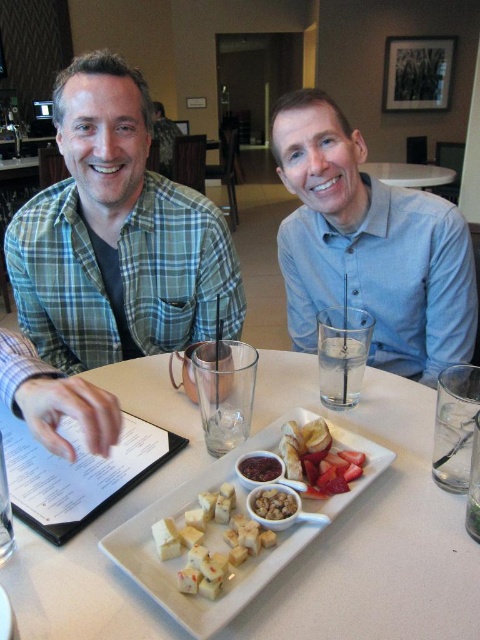
You are a server in a restaurant and need to place a new dish on the table. The dish is 3 inches tall. The table has the white ceramic platter at center and the white crumbly cheese at center. Can you safely place the dish on the table without it touching the existing items?

The white ceramic platter at center has a greater height compared to the white crumbly cheese at center. Since the dish is 3 inches tall, you can place it on the table as long as it doesn not touch the taller white ceramic platter at center.

You are a waiter in a restaurant and need to place a new dessert plate on the right side of the white glossy table at center. Where should you place the dessert plate relative to the white crumbly cheese at center?

The white crumbly cheese at center is on the left side of the white glossy table at center, so you should place the dessert plate on the right side of the white crumbly cheese at center to be on the right side of the table.

You are a waiter in a restaurant and need to place a new drink order on the table. The table has a white ceramic platter at center. Where should you place the drink to ensure it is not directly under the overhead fan located at coordinate point 1.0, 0.0? Please provide coordinates in the format of a point with two decimal places.

The white ceramic platter at center is located at point (179, 557). To avoid placing the drink directly under the overhead fan at (0, 639), you should place the drink at a coordinate such as (240, 448), which is away from the fan and clear of the platter.